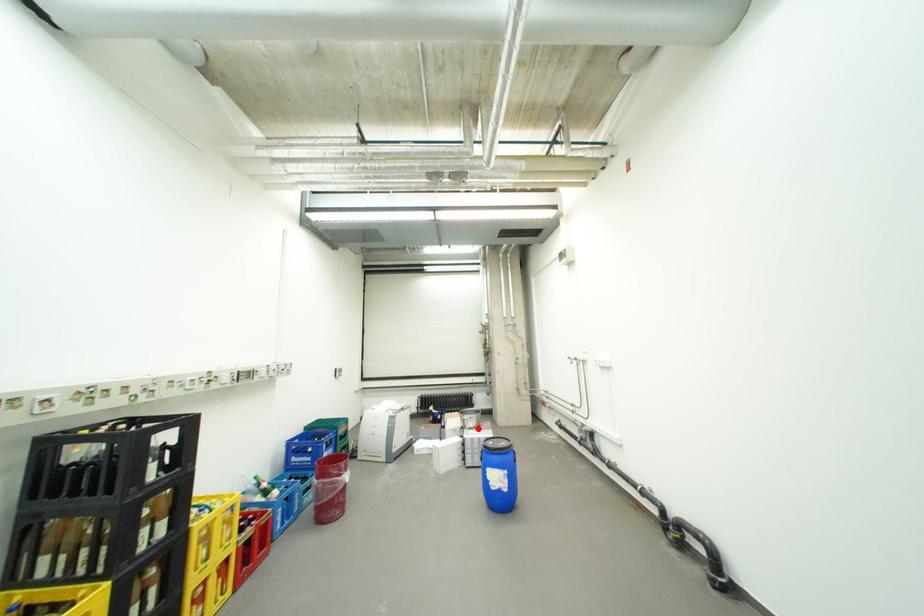
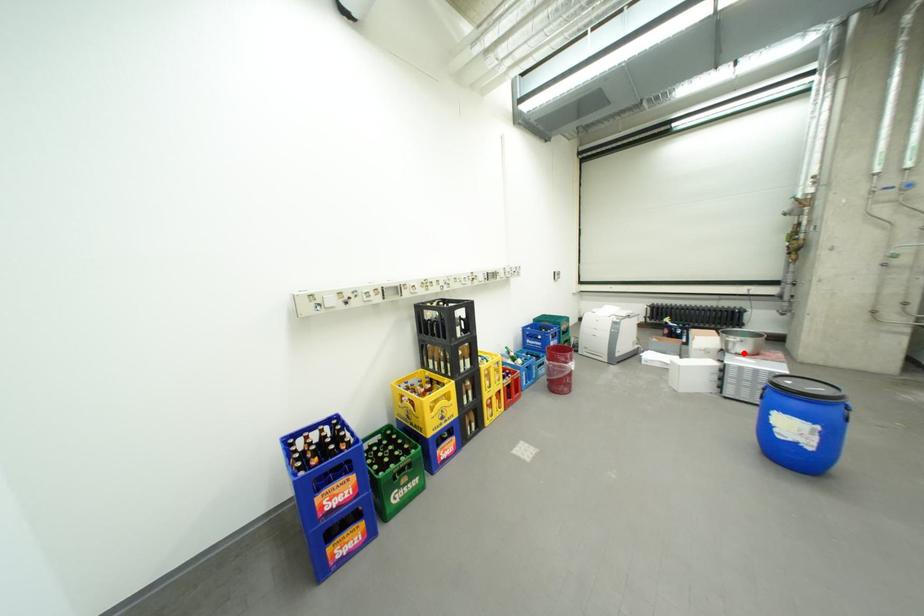
I am providing you with two images of the same scene from different viewpoints. A red point is marked on the first image and another point is marked on the second image. Is the red point in image1 aligned with the point shown in image2?

Yes